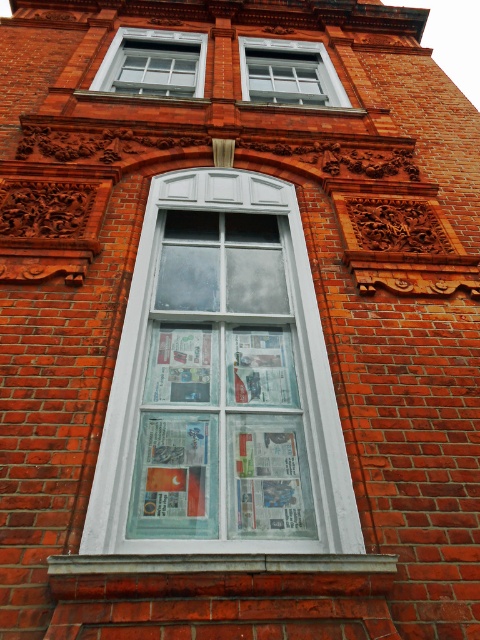
Which is below, white glass window at center or clear glass window at upper center?

white glass window at center is below.

Which is more to the right, white glass window at center or clear glass window at upper center?

white glass window at center

Find the location of a particular element. Image resolution: width=480 pixels, height=640 pixels. white glass window at center is located at coordinates (222, 385).

Which is in front, point (178, 61) or point (297, 77)?

Point (297, 77) is more forward.

Consider the image. Is clear glass window at upper center above white glass window at upper center?

Indeed, clear glass window at upper center is positioned over white glass window at upper center.

Find the location of a particular element. The width and height of the screenshot is (480, 640). clear glass window at upper center is located at coordinates (154, 64).

Which is above, white glass window at center or white glass window at upper center?

white glass window at upper center is higher up.

Which is behind, point (154, 531) or point (240, 77)?

Point (240, 77)

Find the location of a particular element. This screenshot has width=480, height=640. white glass window at center is located at coordinates (222, 385).